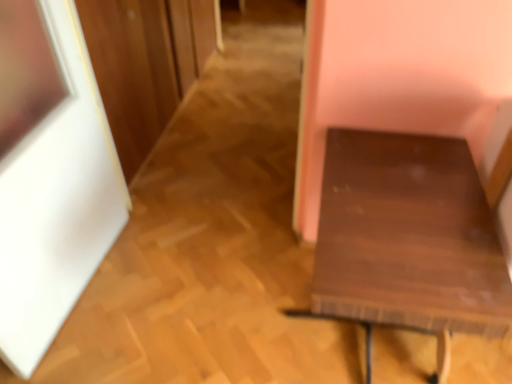
Locate an element on the screen. The height and width of the screenshot is (384, 512). vacant space that's between dark wood table at right and white matte picture frame at left is located at coordinates (188, 299).